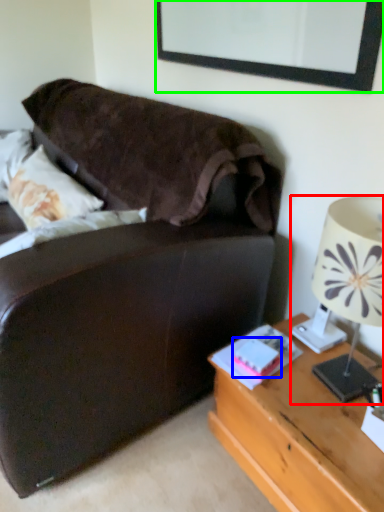
Question: Which object is the closest to the lamp (highlighted by a red box)? Choose among these: book (highlighted by a blue box) or picture frame (highlighted by a green box).

Choices:
 (A) book
 (B) picture frame

Answer: (A)